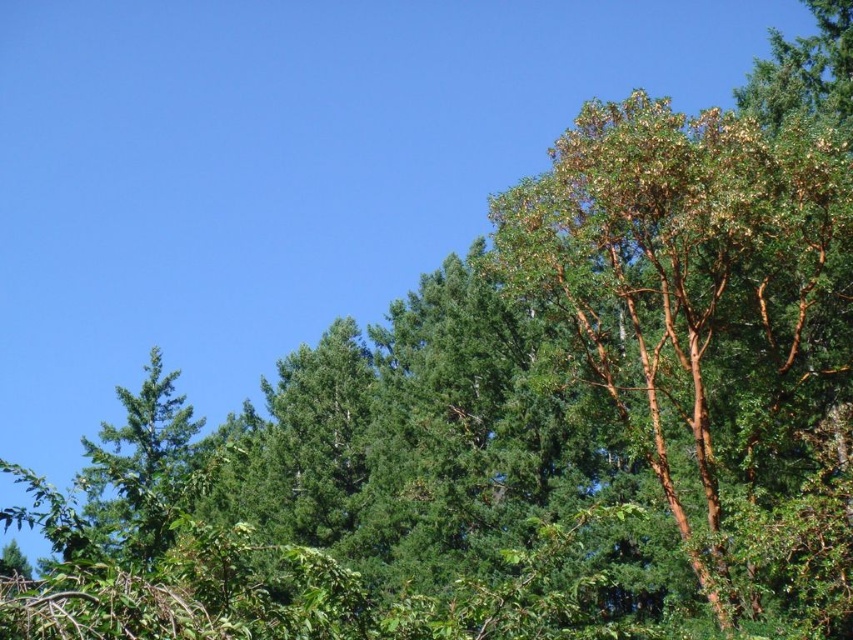
You are standing in the vibrant natural scene described. There are two points marked in the image, point (796, 333) and point (91, 484). Which point is closer to you?

Point (796, 333) is in front of point (91, 484), so it is closer to you.